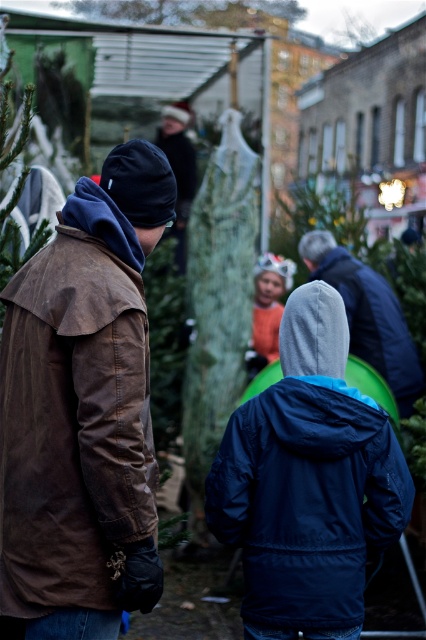
Can you confirm if dark blue jacket at center is positioned below green matte christmas tree at upper center?

Yes.

What do you see at coordinates (368, 314) in the screenshot? I see `dark blue jacket at center` at bounding box center [368, 314].

Locate an element on the screen. The height and width of the screenshot is (640, 426). dark blue jacket at center is located at coordinates (368, 314).

Is brown waxed leather jacket at left positioned at the back of green textured christmas tree at center?

No, brown waxed leather jacket at left is closer to the viewer.

Find the location of a particular element. brown waxed leather jacket at left is located at coordinates (83, 408).

Where is `brown waxed leather jacket at left`? brown waxed leather jacket at left is located at coordinates (83, 408).

In the scene shown: Which is more to the right, blue fabric jacket at center or green textured christmas tree at center?

blue fabric jacket at center

Is blue fabric jacket at center positioned in front of green textured christmas tree at center?

Yes.

Is point (351, 573) positioned behind point (198, 310)?

No, it is in front of (198, 310).

You are a GUI agent. You are given a task and a screenshot of the screen. Output one action in this format:
    pyautogui.click(x=<x>, y=<y>)
    Task: Click on the blue fabric jacket at center
    This screenshot has width=426, height=640.
    Given the screenshot: What is the action you would take?
    pyautogui.click(x=307, y=483)